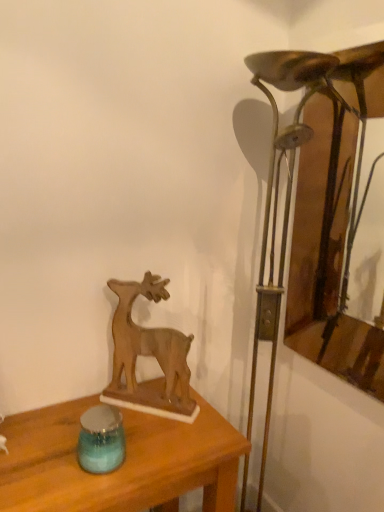
Identify the location of vacant region in front of wooden deer at center. The image size is (384, 512). (151, 443).